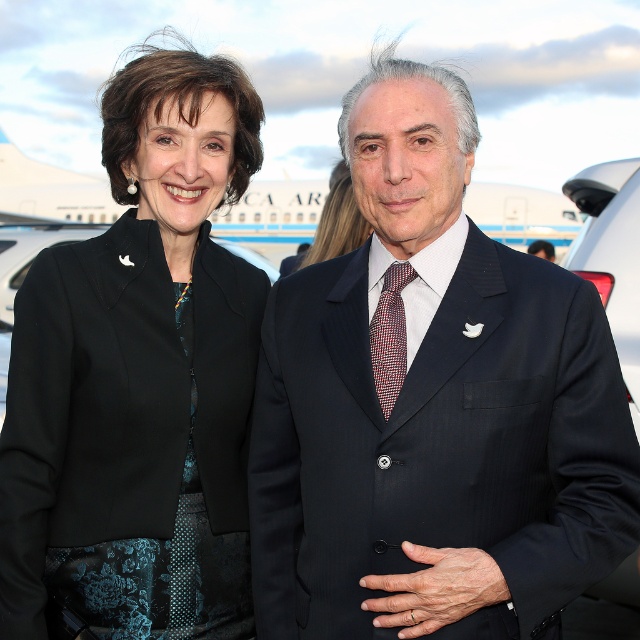
The height and width of the screenshot is (640, 640). Describe the element at coordinates (433, 408) in the screenshot. I see `dark blue pinstripe suit at center` at that location.

Is dark blue pinstripe suit at center shorter than plaid silk tie at center?

No, dark blue pinstripe suit at center is not shorter than plaid silk tie at center.

Between point (353, 442) and point (397, 376), which one is positioned in front?

Point (353, 442) is more forward.

The height and width of the screenshot is (640, 640). Find the location of `dark blue pinstripe suit at center`. dark blue pinstripe suit at center is located at coordinates (433, 408).

Is black fabric jacket at upper left smaller than matte black blazer at center?

Yes.

Which is above, black fabric jacket at upper left or matte black blazer at center?

matte black blazer at center is above.

Is point (116, 422) positioned in front of point (348, 244)?

That is True.

Where is `black fabric jacket at upper left`? black fabric jacket at upper left is located at coordinates (140, 380).

Is dark blue pinstripe suit at center further to camera compared to black fabric jacket at upper left?

No, dark blue pinstripe suit at center is in front of black fabric jacket at upper left.

Who is more distant from viewer, (452,570) or (156,600)?

Positioned behind is point (156,600).

The image size is (640, 640). What do you see at coordinates (433, 408) in the screenshot?
I see `dark blue pinstripe suit at center` at bounding box center [433, 408].

The width and height of the screenshot is (640, 640). I want to click on dark blue pinstripe suit at center, so click(x=433, y=408).